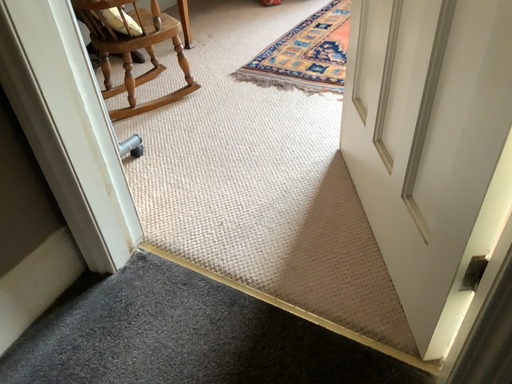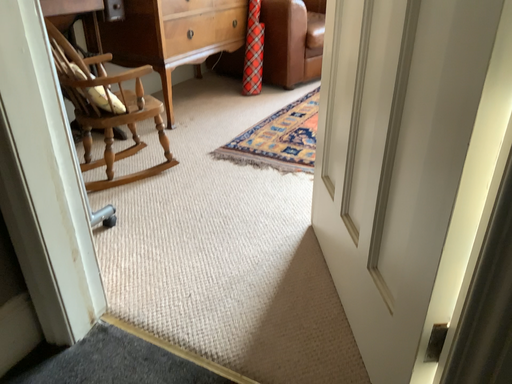
Question: Which way did the camera rotate in the video?

Choices:
 (A) rotated downward
 (B) rotated upward

Answer: (B)